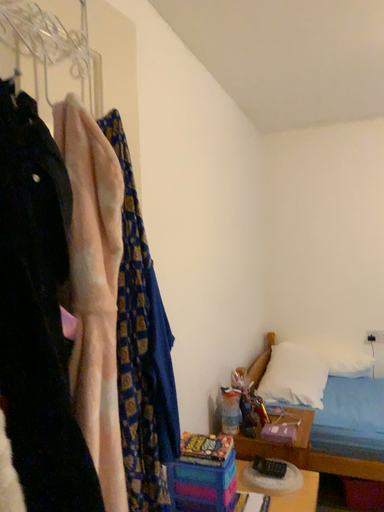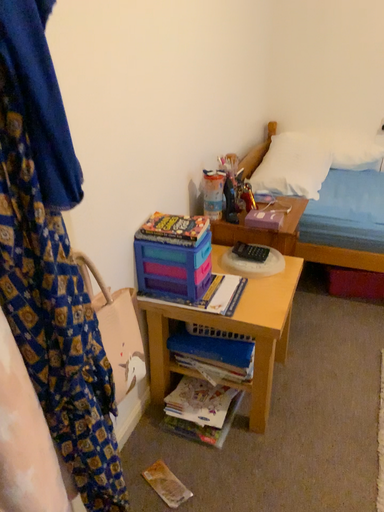
Question: Which way did the camera rotate in the video?

Choices:
 (A) rotated upward
 (B) rotated downward

Answer: (B)